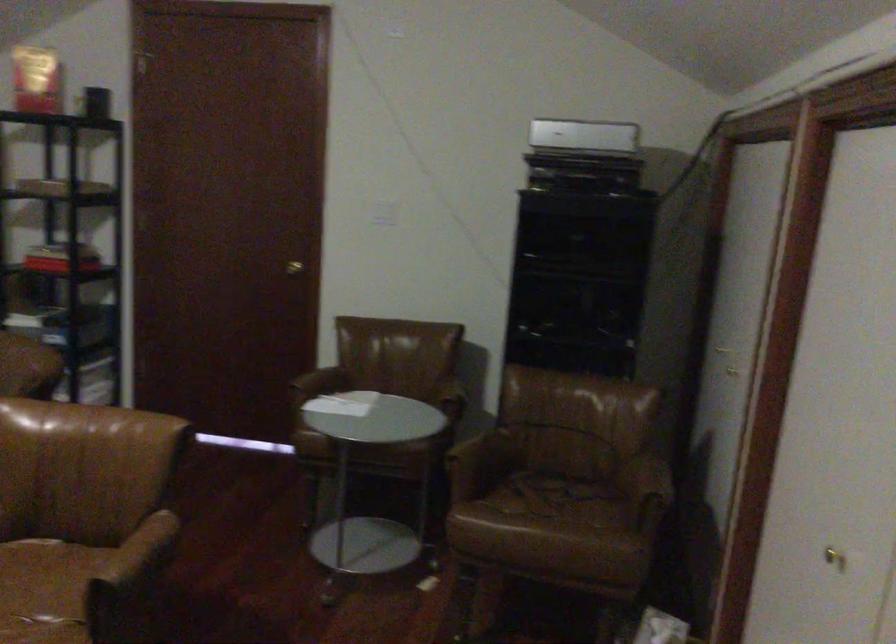
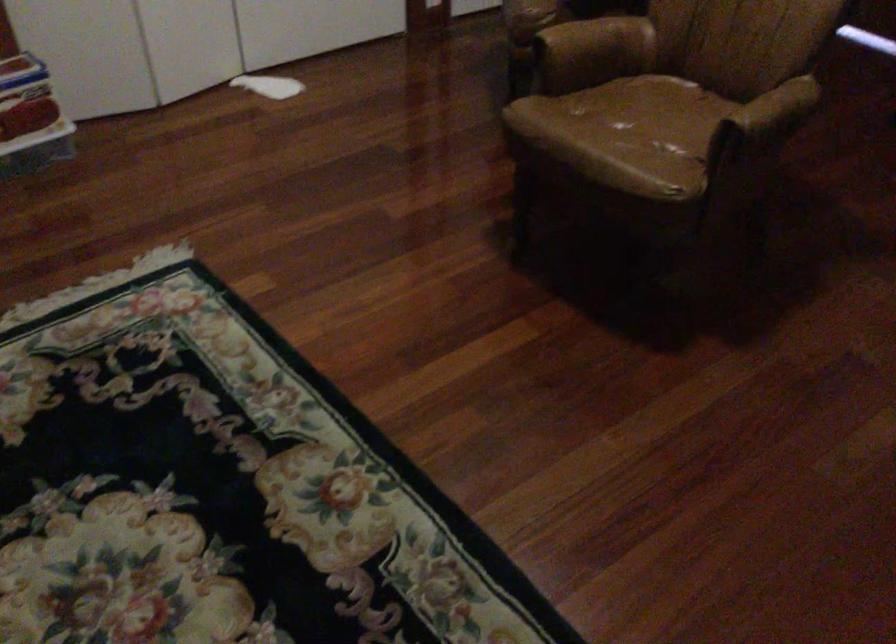
Locate, in the second image, the point that corresponds to the point at 151,545 in the first image.

(776, 109)